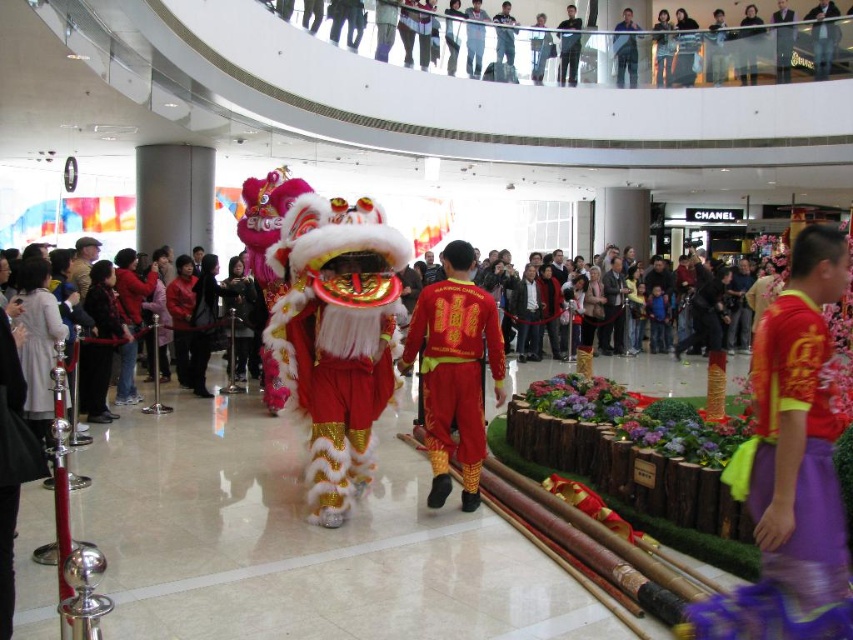
Can you confirm if red satin skirt at lower right is positioned below red satin costume at center?

Yes.

Is red satin skirt at lower right thinner than red satin costume at center?

Correct, red satin skirt at lower right's width is less than red satin costume at center's.

The image size is (853, 640). What do you see at coordinates (787, 492) in the screenshot? I see `red satin skirt at lower right` at bounding box center [787, 492].

Locate an element on the screen. The width and height of the screenshot is (853, 640). red satin skirt at lower right is located at coordinates (787, 492).

Is blue fabric shirt at upper center shorter than matte black jacket at upper center?

Indeed, blue fabric shirt at upper center has a lesser height compared to matte black jacket at upper center.

Looking at this image, can you confirm if blue fabric shirt at upper center is wider than matte black jacket at upper center?

Incorrect, blue fabric shirt at upper center's width does not surpass matte black jacket at upper center's.

Is point (635, 58) positioned before point (776, 44)?

No.

Where is `blue fabric shirt at upper center`? The width and height of the screenshot is (853, 640). blue fabric shirt at upper center is located at coordinates (625, 49).

Looking at this image, can you confirm if red satin skirt at lower right is taller than matte black jacket at upper center?

In fact, red satin skirt at lower right may be shorter than matte black jacket at upper center.

Looking at this image, how much distance is there between red satin skirt at lower right and matte black jacket at upper center?

The distance of red satin skirt at lower right from matte black jacket at upper center is 24.34 meters.

Where is `red satin skirt at lower right`? red satin skirt at lower right is located at coordinates (787, 492).